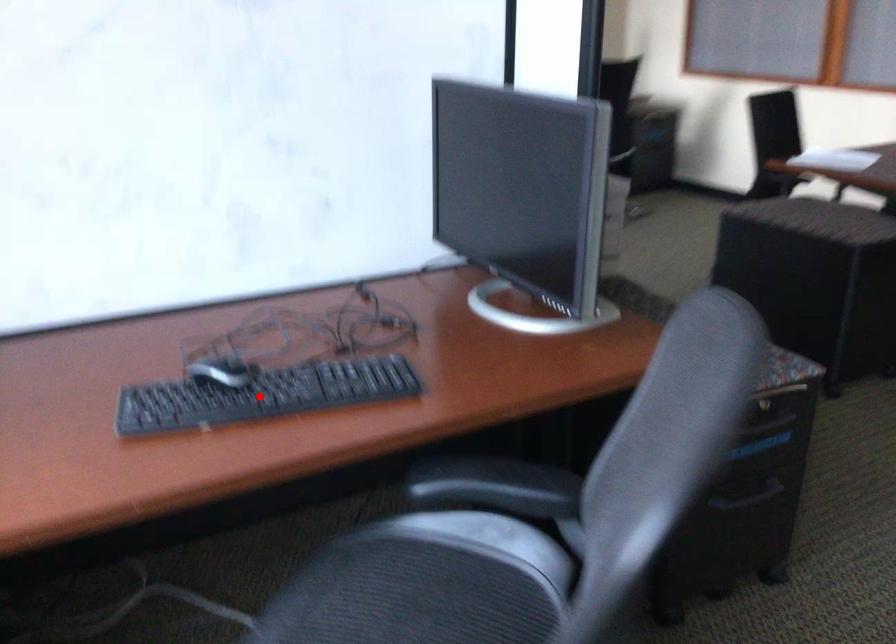
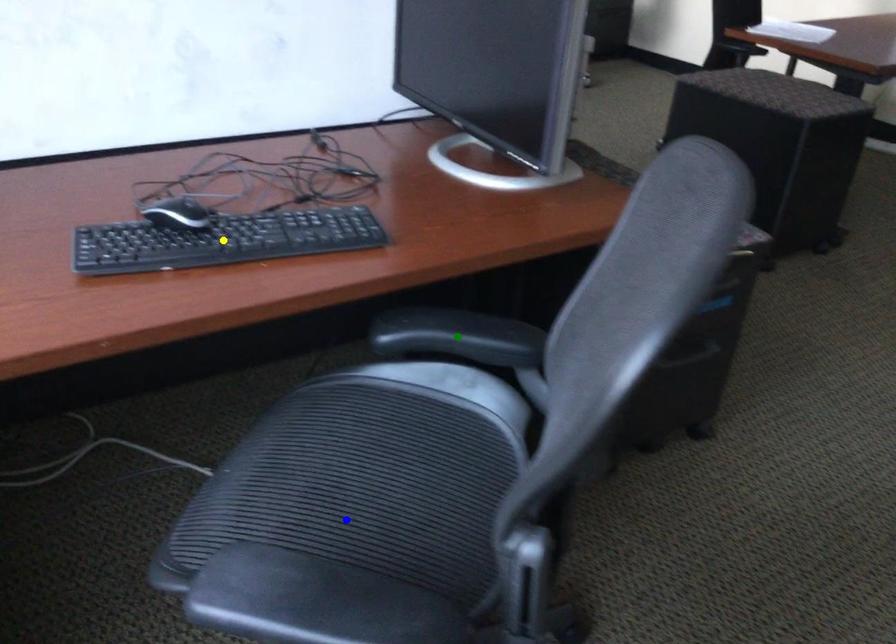
Question: I am providing you with two images of the same scene from different viewpoints. A red point is marked on the first image. You are given multiple points on the second image. Can you choose the point in image 2 that corresponds to the point in image 1?

Choices:
 (A) blue point
 (B) green point
 (C) yellow point

Answer: (C)